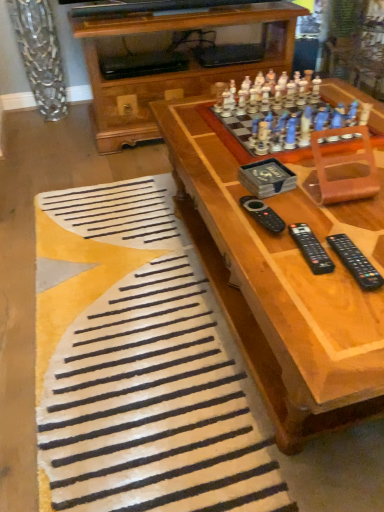
At what (x,y) coordinates should I click in order to perform the action: click on free space in front of black plastic remote at lower right, the 3th remote viewed from the left. Please return your answer as a coordinate pair (x, y). Looking at the image, I should click on (343, 320).